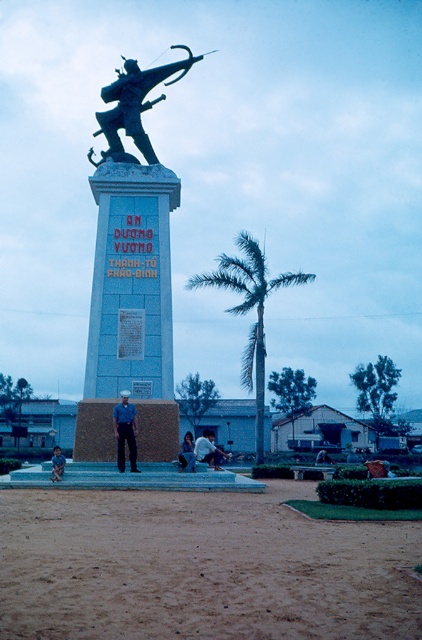
You are a photographer trying to capture a closeup of the monument. You notice the white fabric shirt at lower center and dark blue jeans at lower center in your shot. Which clothing item should you adjust to ensure the monument is fully visible?

The white fabric shirt at lower center is larger in size than dark blue jeans at lower center, so adjusting the white fabric shirt at lower center would be more effective in clearing the view of the monument.